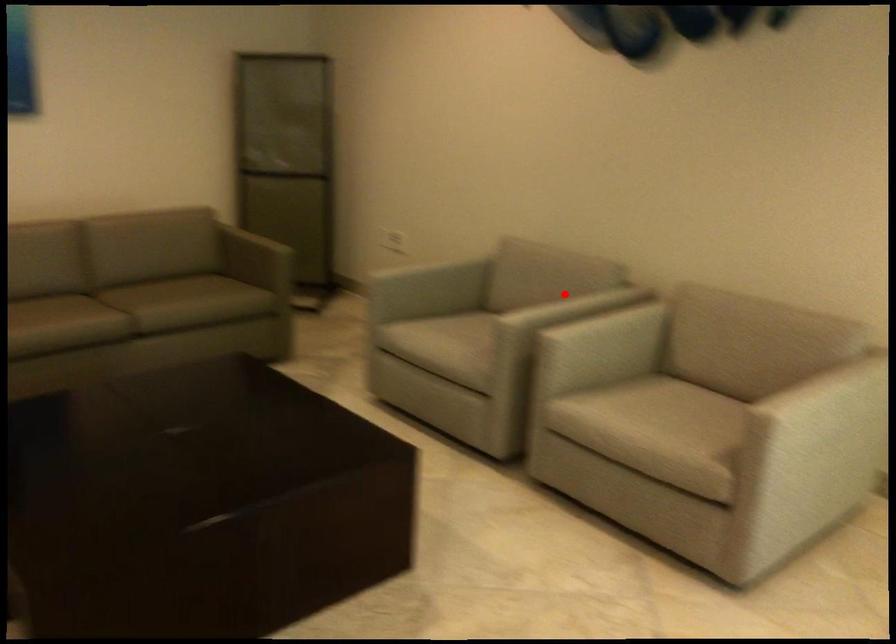
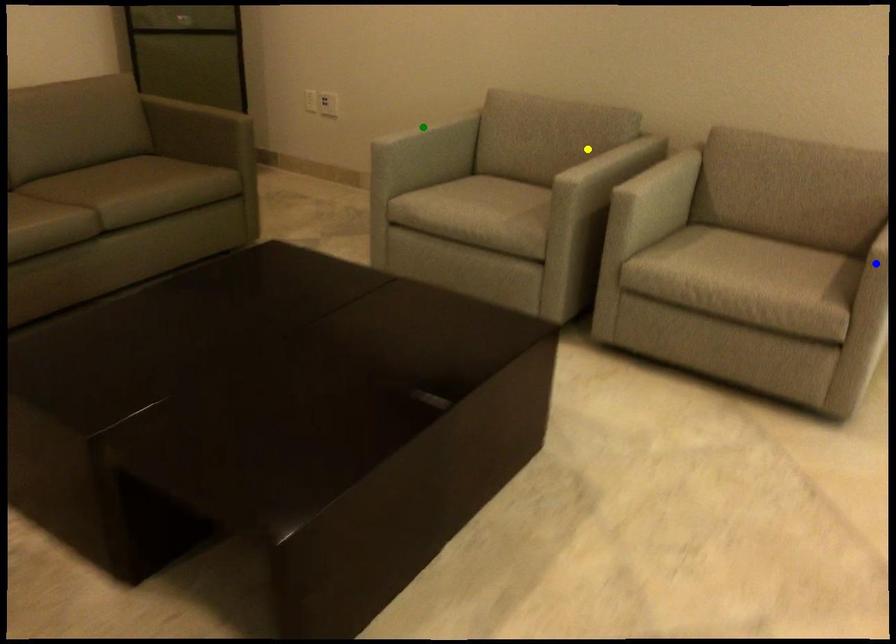
Question: I am providing you with two images of the same scene from different viewpoints. A red point is marked on the first image. You are given multiple points on the second image. Which point in image 2 represents the same 3d spot as the red point in image 1?

Choices:
 (A) yellow point
 (B) blue point
 (C) green point

Answer: (A)